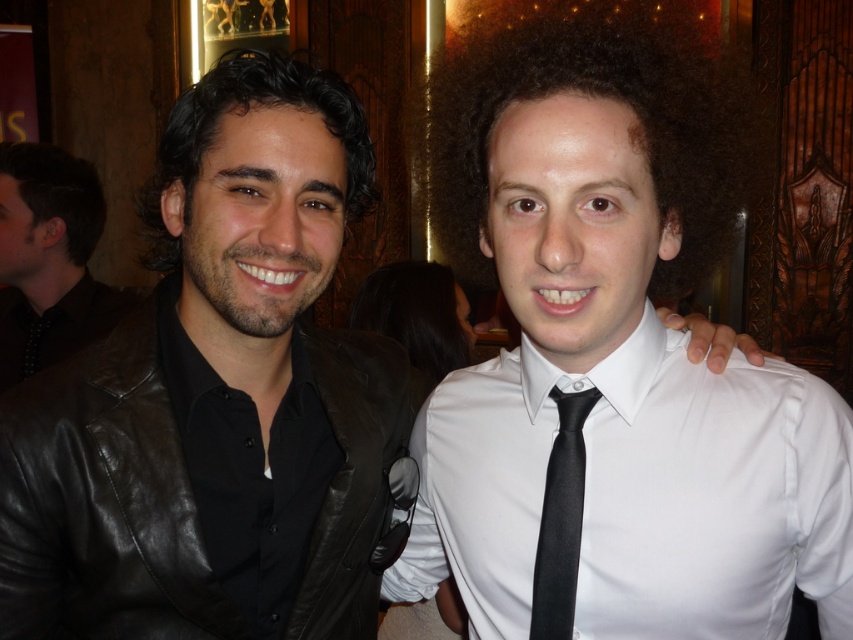
You are a photographer trying to adjust the focus of your camera. You have a focus point at point (97, 500). Which object should you use this focus point for?

The focus point at (97, 500) should be used for the black leather jacket at left since it is represented by that point.

You are a photographer adjusting the lighting for a portrait. You notice the white satin shirt at right and the black satin tie at center. Which object is located more to the left?

The white satin shirt at right is positioned on the left side of the black satin tie at center, so the white satin shirt at right is more to the left.

You are standing in front of the image and want to locate the black leather jacket at left. Where should you look?

You should look at point (97, 500) to locate the black leather jacket at left.